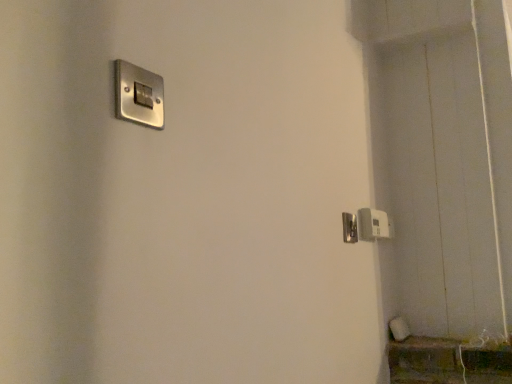
Question: In terms of width, does satin silver switch at upper left, the 1th light switch in the top-to-bottom sequence, look wider or thinner when compared to white plastic light switch at lower right, arranged as the second light switch when viewed from the top?

Choices:
 (A) wide
 (B) thin

Answer: (B)

Question: From a real-world perspective, is satin silver switch at upper left, which is the 2th light switch in bottom-to-top order, physically located above or below white plastic light switch at lower right, positioned as the second light switch in front-to-back order?

Choices:
 (A) below
 (B) above

Answer: (B)

Question: Considering the real-world distances, which object is closest to the satin nickel door handle at right?

Choices:
 (A) satin silver switch at upper left, positioned as the 1th light switch in front-to-back order
 (B) white plastic light switch at lower right, the first light switch from the bottom

Answer: (B)

Question: Which object is positioned closest to the satin nickel door handle at right?

Choices:
 (A) white plastic light switch at lower right, the first light switch from the bottom
 (B) satin silver switch at upper left, marked as the second light switch in a back-to-front arrangement

Answer: (A)